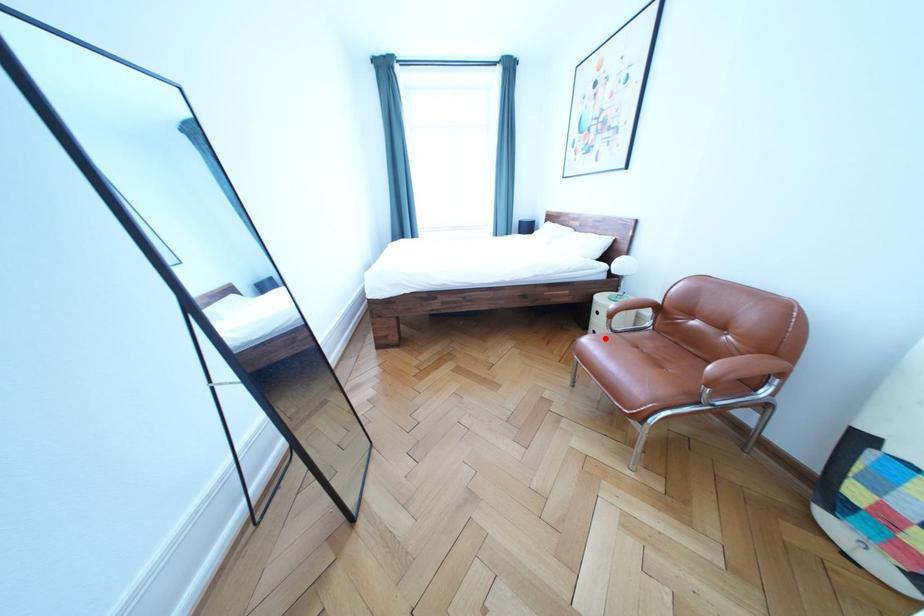
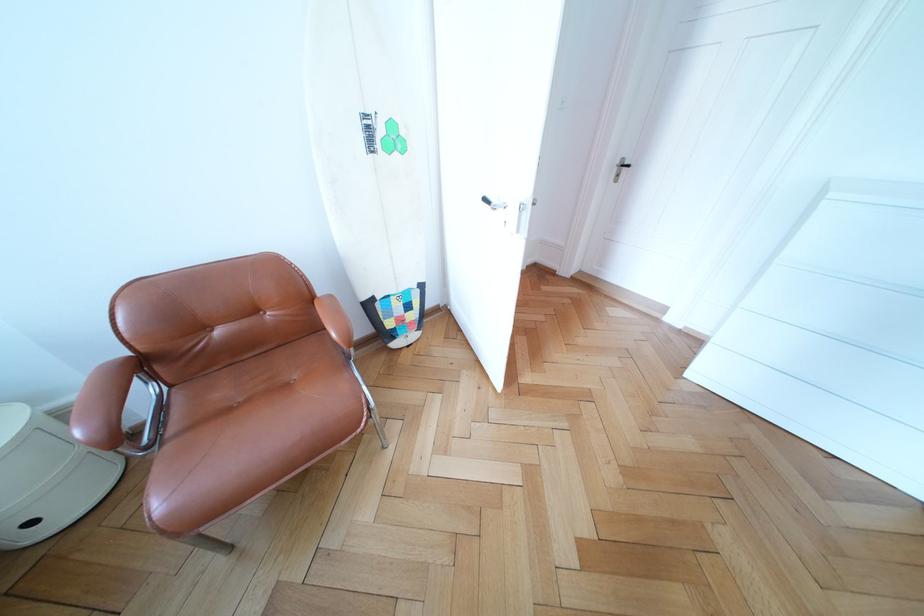
Question: I am providing you with two images of the same scene from different viewpoints. Image1 has a red point marked. In image2, the corresponding 3D location appears at what relative position? Reply with the corresponding letter.

Choices:
 (A) Closer
 (B) Farther

Answer: (B)